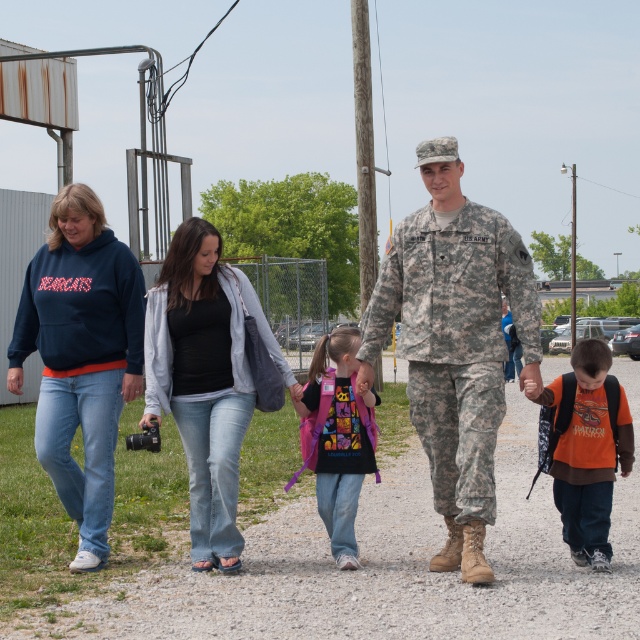
Question: Considering the relative positions of denim jeans at center and matte purple backpack at center in the image provided, where is denim jeans at center located with respect to matte purple backpack at center?

Choices:
 (A) left
 (B) right

Answer: (A)

Question: Does navy blue hoodie at left appear on the right side of matte purple backpack at center?

Choices:
 (A) yes
 (B) no

Answer: (B)

Question: Which of these objects is positioned farthest from the camouflage fabric uniform at center?

Choices:
 (A) camouflage uniform at center
 (B) matte purple backpack at center
 (C) navy blue hoodie at left
 (D) orange cotton shirt at lower right

Answer: (C)

Question: Estimate the real-world distances between objects in this image. Which object is farther from the navy blue hoodie at left?

Choices:
 (A) orange cotton shirt at lower right
 (B) camouflage fabric uniform at center
 (C) denim jeans at center
 (D) camouflage uniform at center

Answer: (A)

Question: Which point appears farthest from the camera in this image?

Choices:
 (A) (509, 248)
 (B) (593, 564)
 (C) (35, 260)

Answer: (C)

Question: In this image, where is denim jeans at center located relative to orange cotton shirt at lower right?

Choices:
 (A) left
 (B) right

Answer: (A)